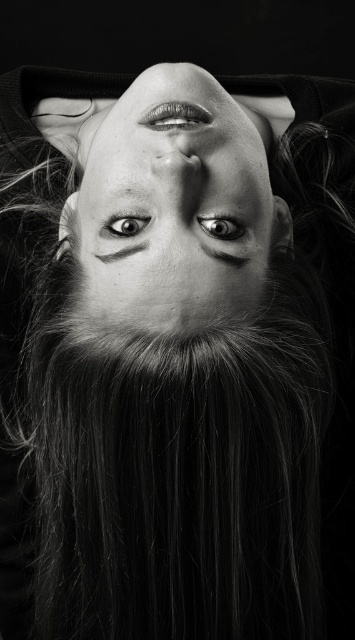
The image size is (355, 640). Describe the element at coordinates (171, 205) in the screenshot. I see `smooth skin face at center` at that location.

Is point (160, 97) farther from camera compared to point (219, 230)?

Yes, it is behind point (219, 230).

This screenshot has height=640, width=355. I want to click on smooth skin face at center, so click(x=171, y=205).

This screenshot has width=355, height=640. What are the coordinates of `smooth skin face at center` in the screenshot? It's located at (171, 205).

Is shiny black eye at center smaller than shiny silver eye at center?

Actually, shiny black eye at center might be larger than shiny silver eye at center.

Can you confirm if shiny black eye at center is bigger than shiny silver eye at center?

Yes.

The height and width of the screenshot is (640, 355). Find the location of `shiny black eye at center`. shiny black eye at center is located at coordinates (221, 227).

I want to click on shiny black eye at center, so click(221, 227).

The height and width of the screenshot is (640, 355). Identify the location of smooth skin face at center. (171, 205).

Locate an element on the screen. The height and width of the screenshot is (640, 355). smooth skin face at center is located at coordinates (171, 205).